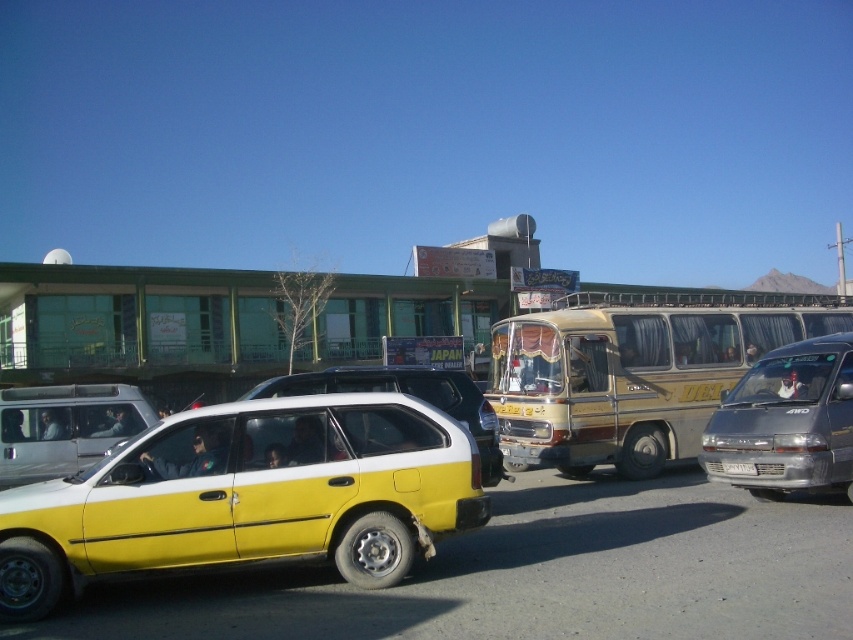
Can you confirm if metallic silver van at center is positioned above white plastic license plate at center?

Indeed, metallic silver van at center is positioned over white plastic license plate at center.

Who is higher up, metallic silver van at center or white plastic license plate at center?

Positioned higher is metallic silver van at center.

Which is behind, point (67, 404) or point (722, 464)?

Positioned behind is point (67, 404).

In order to click on metallic silver van at center in this screenshot , I will do `click(64, 428)`.

Who is more distant from viewer, (136, 504) or (485, 474)?

Positioned behind is point (485, 474).

What do you see at coordinates (248, 497) in the screenshot? The image size is (853, 640). I see `yellow matte hatchback at lower left` at bounding box center [248, 497].

I want to click on yellow matte hatchback at lower left, so click(248, 497).

Does metallic silver sedan at center have a greater height compared to white plastic license plate at center?

Yes, metallic silver sedan at center is taller than white plastic license plate at center.

Can you confirm if metallic silver sedan at center is thinner than white plastic license plate at center?

In fact, metallic silver sedan at center might be wider than white plastic license plate at center.

Identify the location of metallic silver sedan at center. (787, 420).

Identify the location of metallic silver sedan at center. (787, 420).